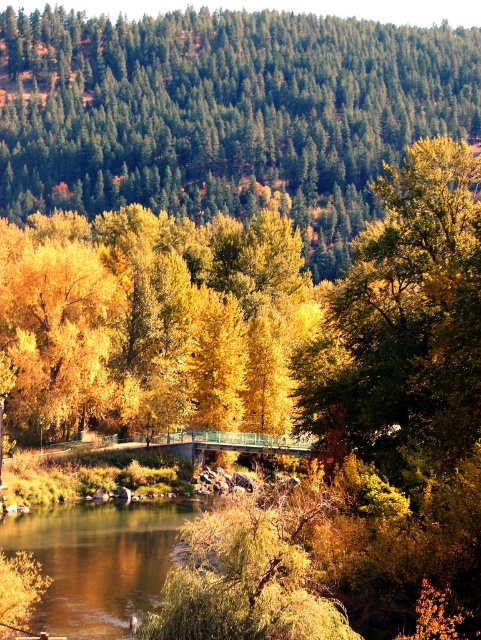
Can you confirm if yellow/golden leaves at center is shorter than brown smooth river at center?

No.

Which is behind, point (150, 314) or point (8, 547)?

Point (150, 314)

The image size is (481, 640). What do you see at coordinates (151, 321) in the screenshot? I see `yellow/golden leaves at center` at bounding box center [151, 321].

Identify the location of yellow/golden leaves at center. The image size is (481, 640). (151, 321).

Can you confirm if yellow matte tree at upper center is positioned to the left of brown smooth river at center?

No, yellow matte tree at upper center is not to the left of brown smooth river at center.

Is yellow matte tree at upper center above brown smooth river at center?

Indeed, yellow matte tree at upper center is positioned over brown smooth river at center.

Who is more forward, (33,74) or (122,570)?

Point (122,570) is more forward.

In order to click on yellow matte tree at upper center in this screenshot , I will do `click(225, 113)`.

Who is more distant from viewer, (66,44) or (152,401)?

Point (66,44)

Is point (480, 122) less distant than point (139, 316)?

No, (480, 122) is further to viewer.

Locate an element on the screen. The image size is (481, 640). yellow matte tree at upper center is located at coordinates (225, 113).